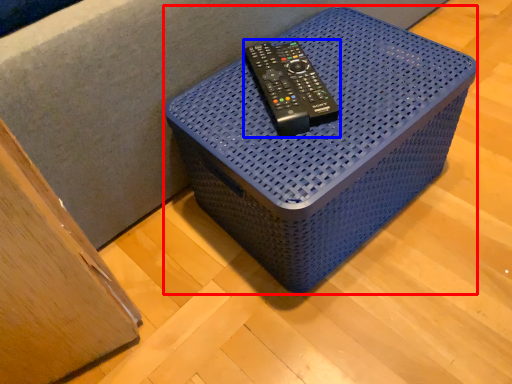
Question: Which of the following is the closest to the observer, furniture (highlighted by a red box) or equipment (highlighted by a blue box)?

Choices:
 (A) furniture
 (B) equipment

Answer: (A)